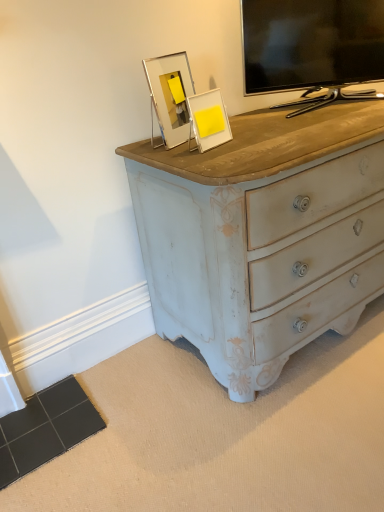
Image resolution: width=384 pixels, height=512 pixels. What do you see at coordinates (311, 42) in the screenshot?
I see `black glossy tv at upper right` at bounding box center [311, 42].

Find the location of a particular element. yellow matte picture frame at upper center, which is the 2th picture frame in left-to-right order is located at coordinates coord(208,120).

The height and width of the screenshot is (512, 384). Find the location of `clear acrylic frame at upper center, positioned as the 1th picture frame in left-to-right order`. clear acrylic frame at upper center, positioned as the 1th picture frame in left-to-right order is located at coordinates (170, 95).

Locate an element on the screen. The image size is (384, 512). black glossy tv at upper right is located at coordinates [x=311, y=42].

From a real-world perspective, is clear acrylic frame at upper center, placed as the 2th picture frame when sorted from right to left, positioned over yellow matte picture frame at upper center, which ranks as the 1th picture frame in right-to-left order, based on gravity?

Yes, from a real-world perspective, clear acrylic frame at upper center, placed as the 2th picture frame when sorted from right to left, is above yellow matte picture frame at upper center, which ranks as the 1th picture frame in right-to-left order.

From the image's perspective, is clear acrylic frame at upper center, positioned as the 1th picture frame in left-to-right order, above or below yellow matte picture frame at upper center, which ranks as the 1th picture frame in right-to-left order?

clear acrylic frame at upper center, positioned as the 1th picture frame in left-to-right order, is above yellow matte picture frame at upper center, which ranks as the 1th picture frame in right-to-left order.

Is clear acrylic frame at upper center, placed as the 2th picture frame when sorted from right to left, placed right next to yellow matte picture frame at upper center, which ranks as the 1th picture frame in right-to-left order?

Yes, the surface of clear acrylic frame at upper center, placed as the 2th picture frame when sorted from right to left, is in contact with yellow matte picture frame at upper center, which ranks as the 1th picture frame in right-to-left order.

In the scene shown: How different are the orientations of clear acrylic frame at upper center, positioned as the 1th picture frame in left-to-right order, and yellow matte picture frame at upper center, which is the 2th picture frame in left-to-right order, in degrees?

5.78 degrees separate the facing orientations of clear acrylic frame at upper center, positioned as the 1th picture frame in left-to-right order, and yellow matte picture frame at upper center, which is the 2th picture frame in left-to-right order.

This screenshot has width=384, height=512. I want to click on picture frame that is the 2nd one when counting downward from the black glossy tv at upper right (from the image's perspective), so click(x=208, y=120).

Does black glossy tv at upper right have a greater height compared to yellow matte picture frame at upper center, which is the 2th picture frame in left-to-right order?

Indeed, black glossy tv at upper right has a greater height compared to yellow matte picture frame at upper center, which is the 2th picture frame in left-to-right order.

Which is farther, (249, 26) or (220, 132)?

Positioned behind is point (249, 26).

Between black glossy tv at upper right and yellow matte picture frame at upper center, which is the 2th picture frame in left-to-right order, which one has larger width?

black glossy tv at upper right.

Considering the sizes of clear acrylic frame at upper center, placed as the 2th picture frame when sorted from right to left, and black glossy tv at upper right in the image, is clear acrylic frame at upper center, placed as the 2th picture frame when sorted from right to left, bigger or smaller than black glossy tv at upper right?

Considering their sizes, clear acrylic frame at upper center, placed as the 2th picture frame when sorted from right to left, takes up less space than black glossy tv at upper right.

Where is `television on the right of clear acrylic frame at upper center, positioned as the 1th picture frame in left-to-right order`? The width and height of the screenshot is (384, 512). television on the right of clear acrylic frame at upper center, positioned as the 1th picture frame in left-to-right order is located at coordinates (311, 42).

From a real-world perspective, does clear acrylic frame at upper center, placed as the 2th picture frame when sorted from right to left, sit lower than black glossy tv at upper right?

Yes, from a real-world perspective, clear acrylic frame at upper center, placed as the 2th picture frame when sorted from right to left, is beneath black glossy tv at upper right.

Is clear acrylic frame at upper center, placed as the 2th picture frame when sorted from right to left, further to camera compared to black glossy tv at upper right?

No, the depth of clear acrylic frame at upper center, placed as the 2th picture frame when sorted from right to left, is less than that of black glossy tv at upper right.

Considering the positions of point (214, 126) and point (378, 22), is point (214, 126) closer or farther from the camera than point (378, 22)?

Clearly, point (214, 126) is closer to the camera than point (378, 22).

From the image's perspective, which is above, yellow matte picture frame at upper center, which ranks as the 1th picture frame in right-to-left order, or black glossy tv at upper right?

From the image's view, black glossy tv at upper right is above.

Who is bigger, yellow matte picture frame at upper center, which is the 2th picture frame in left-to-right order, or black glossy tv at upper right?

Bigger between the two is black glossy tv at upper right.

Is yellow matte picture frame at upper center, which ranks as the 1th picture frame in right-to-left order, at the left side of black glossy tv at upper right?

Yes, yellow matte picture frame at upper center, which ranks as the 1th picture frame in right-to-left order, is to the left of black glossy tv at upper right.

Looking at this image, from a real-world perspective, which object stands above the other?

In real-world perspective, clear acrylic frame at upper center, positioned as the 1th picture frame in left-to-right order, is above.

Does yellow matte picture frame at upper center, which ranks as the 1th picture frame in right-to-left order, lie in front of clear acrylic frame at upper center, placed as the 2th picture frame when sorted from right to left?

That is True.

From the image's perspective, who appears lower, yellow matte picture frame at upper center, which is the 2th picture frame in left-to-right order, or clear acrylic frame at upper center, placed as the 2th picture frame when sorted from right to left?

yellow matte picture frame at upper center, which is the 2th picture frame in left-to-right order, appears lower in the image.

In terms of size, does yellow matte picture frame at upper center, which ranks as the 1th picture frame in right-to-left order, appear bigger or smaller than clear acrylic frame at upper center, placed as the 2th picture frame when sorted from right to left?

Clearly, yellow matte picture frame at upper center, which ranks as the 1th picture frame in right-to-left order, is smaller in size than clear acrylic frame at upper center, placed as the 2th picture frame when sorted from right to left.

Visually, is black glossy tv at upper right positioned to the left or to the right of clear acrylic frame at upper center, placed as the 2th picture frame when sorted from right to left?

Based on their positions, black glossy tv at upper right is located to the right of clear acrylic frame at upper center, placed as the 2th picture frame when sorted from right to left.

Could you tell me if black glossy tv at upper right is turned towards clear acrylic frame at upper center, positioned as the 1th picture frame in left-to-right order?

No, black glossy tv at upper right is not aimed at clear acrylic frame at upper center, positioned as the 1th picture frame in left-to-right order.

Based on the photo, considering the sizes of black glossy tv at upper right and clear acrylic frame at upper center, positioned as the 1th picture frame in left-to-right order, in the image, is black glossy tv at upper right bigger or smaller than clear acrylic frame at upper center, positioned as the 1th picture frame in left-to-right order,?

Considering their sizes, black glossy tv at upper right takes up more space than clear acrylic frame at upper center, positioned as the 1th picture frame in left-to-right order.

Where is `picture frame on the right of clear acrylic frame at upper center, positioned as the 1th picture frame in left-to-right order`? Image resolution: width=384 pixels, height=512 pixels. picture frame on the right of clear acrylic frame at upper center, positioned as the 1th picture frame in left-to-right order is located at coordinates (208, 120).

At what (x,y) coordinates should I click in order to perform the action: click on television located behind the yellow matte picture frame at upper center, which ranks as the 1th picture frame in right-to-left order. Please return your answer as a coordinate pair (x, y). This screenshot has width=384, height=512. Looking at the image, I should click on [311, 42].

Based on their spatial positions, is black glossy tv at upper right or yellow matte picture frame at upper center, which ranks as the 1th picture frame in right-to-left order, closer to clear acrylic frame at upper center, positioned as the 1th picture frame in left-to-right order?

The object closer to clear acrylic frame at upper center, positioned as the 1th picture frame in left-to-right order, is yellow matte picture frame at upper center, which ranks as the 1th picture frame in right-to-left order.

Which object lies nearer to the anchor point black glossy tv at upper right, clear acrylic frame at upper center, positioned as the 1th picture frame in left-to-right order, or yellow matte picture frame at upper center, which is the 2th picture frame in left-to-right order?

yellow matte picture frame at upper center, which is the 2th picture frame in left-to-right order, is positioned closer to the anchor black glossy tv at upper right.

Based on their spatial positions, is black glossy tv at upper right or clear acrylic frame at upper center, placed as the 2th picture frame when sorted from right to left, closer to yellow matte picture frame at upper center, which ranks as the 1th picture frame in right-to-left order?

The object closer to yellow matte picture frame at upper center, which ranks as the 1th picture frame in right-to-left order, is clear acrylic frame at upper center, placed as the 2th picture frame when sorted from right to left.

Considering their positions, is yellow matte picture frame at upper center, which ranks as the 1th picture frame in right-to-left order, positioned further to clear acrylic frame at upper center, positioned as the 1th picture frame in left-to-right order, than black glossy tv at upper right?

black glossy tv at upper right.

Consider the image. Based on their spatial positions, is clear acrylic frame at upper center, placed as the 2th picture frame when sorted from right to left, or black glossy tv at upper right closer to yellow matte picture frame at upper center, which ranks as the 1th picture frame in right-to-left order?

clear acrylic frame at upper center, placed as the 2th picture frame when sorted from right to left, is positioned closer to the anchor yellow matte picture frame at upper center, which ranks as the 1th picture frame in right-to-left order.

When comparing their distances from black glossy tv at upper right, does yellow matte picture frame at upper center, which ranks as the 1th picture frame in right-to-left order, or clear acrylic frame at upper center, placed as the 2th picture frame when sorted from right to left, seem further?

clear acrylic frame at upper center, placed as the 2th picture frame when sorted from right to left, is positioned further to the anchor black glossy tv at upper right.

Locate an element on the screen. picture frame between clear acrylic frame at upper center, positioned as the 1th picture frame in left-to-right order, and black glossy tv at upper right from left to right is located at coordinates (208, 120).